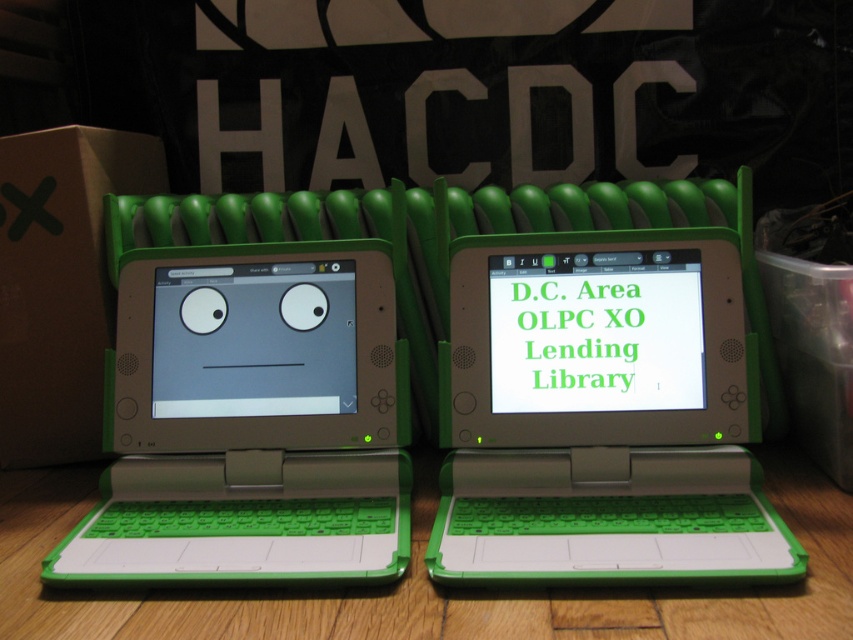
Question: Can you confirm if green matte laptop at center is smaller than green plastic laptops at center?

Choices:
 (A) yes
 (B) no

Answer: (A)

Question: Among these points, which one is farthest from the camera?

Choices:
 (A) (787, 452)
 (B) (264, 518)
 (C) (612, 312)
 (D) (194, 282)

Answer: (A)

Question: Which point is farther to the camera?

Choices:
 (A) (200, 484)
 (B) (405, 632)
 (C) (671, 522)

Answer: (A)

Question: Which object appears farthest from the camera in this image?

Choices:
 (A) green plastic laptops at center
 (B) white plastic laptop at center
 (C) green matte screen at center

Answer: (C)

Question: Is green matte laptop at center in front of green matte screen at center?

Choices:
 (A) yes
 (B) no

Answer: (A)

Question: Does white plastic laptop at center appear under green plastic laptops at center?

Choices:
 (A) yes
 (B) no

Answer: (B)